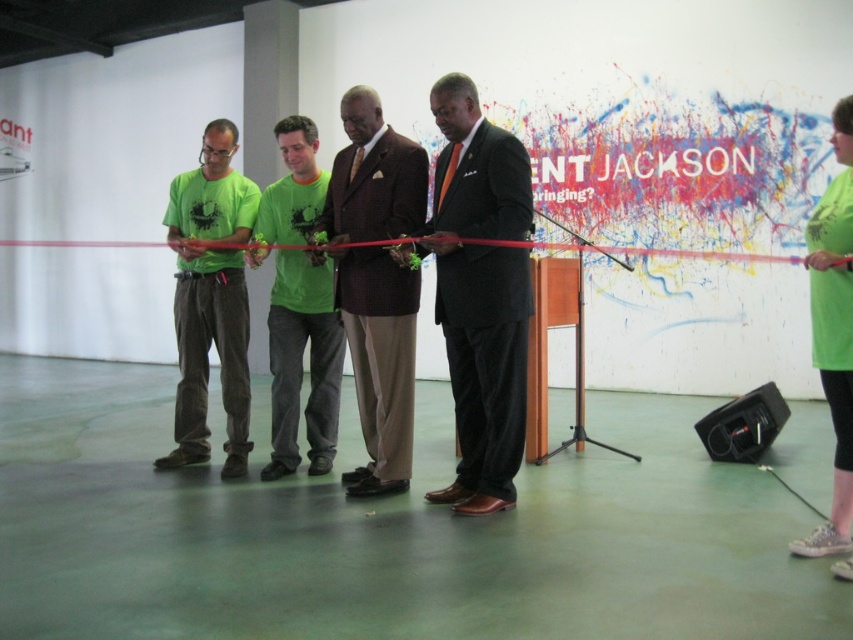
You are organizing a ribbon cutting ceremony and need to ensure that the black satin suit at center and the green fabric shirt at center are visible to all attendees. Based on their sizes, which one is more likely to be seen by people sitting at the back of the room?

The black satin suit at center is larger in size than the green fabric shirt at center, so it is more likely to be seen by people sitting at the back of the room.

You are at the ribbon cutting ceremony and want to know which of the two points, point (386, 460) or point (210, 154), is closer to the group of people. Which one is closer?

Point (386, 460) is in front of point (210, 154), so it is closer to the group of people.